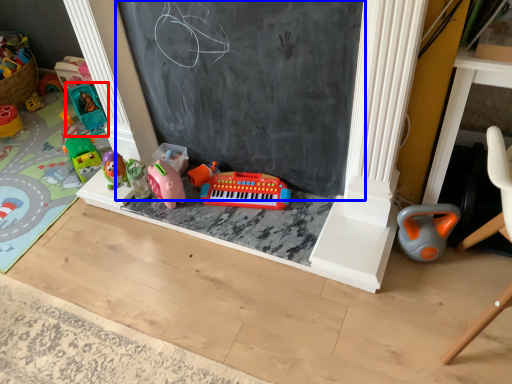
Question: Which object appears closest to the camera in this image, toy (highlighted by a red box) or bulletin board (highlighted by a blue box)?

Choices:
 (A) toy
 (B) bulletin board

Answer: (B)